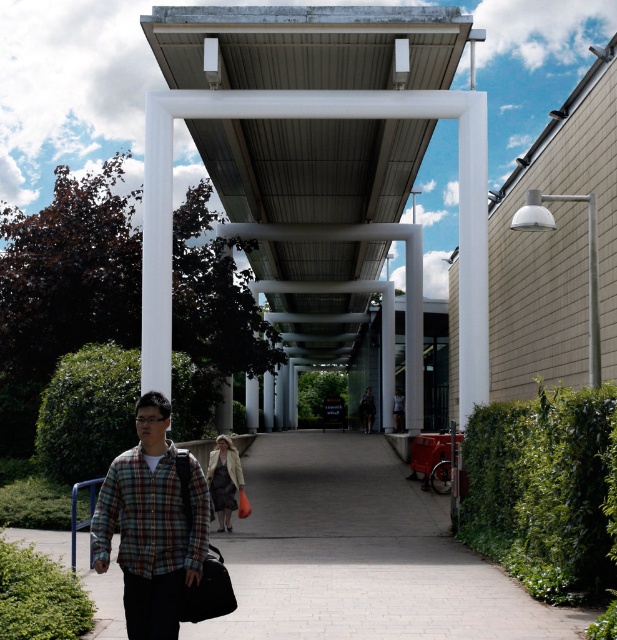
You are a pedestrian walking along the covered walkway and see both the plaid flannel shirt at lower left and the dark gray fabric jacket at center. Which clothing item is positioned higher relative to the other?

The plaid flannel shirt at lower left is located above the dark gray fabric jacket at center, so it is positioned higher.